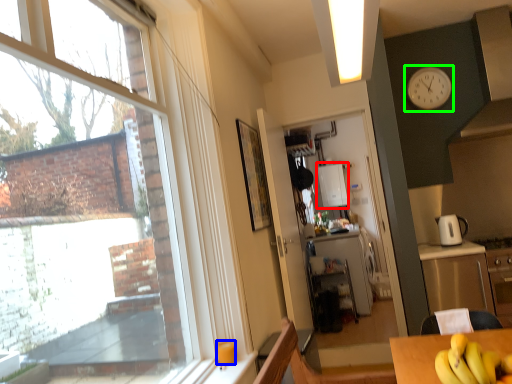
Question: Which object is the closest to the appliance (highlighted by a red box)? Choose among these: coffee cup (highlighted by a blue box) or clock (highlighted by a green box).

Choices:
 (A) coffee cup
 (B) clock

Answer: (B)